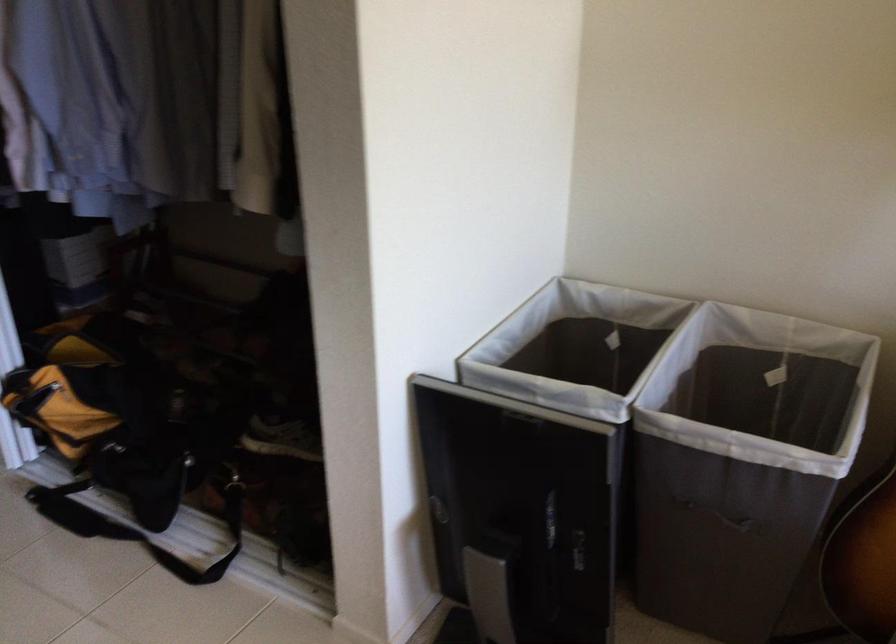
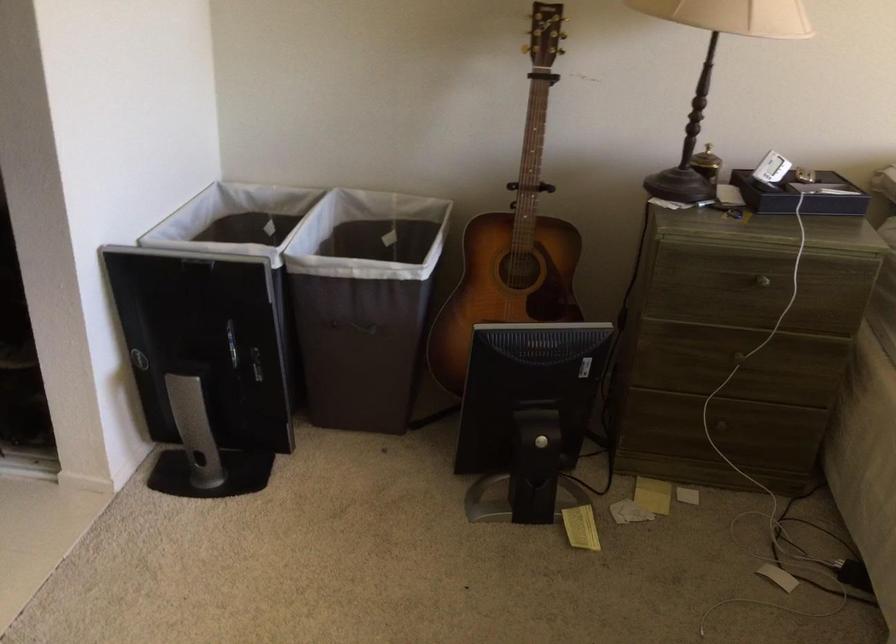
Question: The camera is either moving clockwise (left) or counter-clockwise (right) around the object. The first image is from the beginning of the video and the second image is from the end. Is the camera moving left or right when shooting the video?

Choices:
 (A) Left
 (B) Right

Answer: (A)